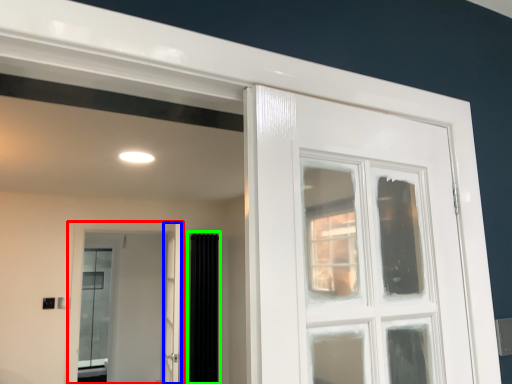
Question: Which object is the closest to the door (highlighted by a red box)? Choose among these: screen door (highlighted by a blue box) or curtain (highlighted by a green box).

Choices:
 (A) screen door
 (B) curtain

Answer: (B)